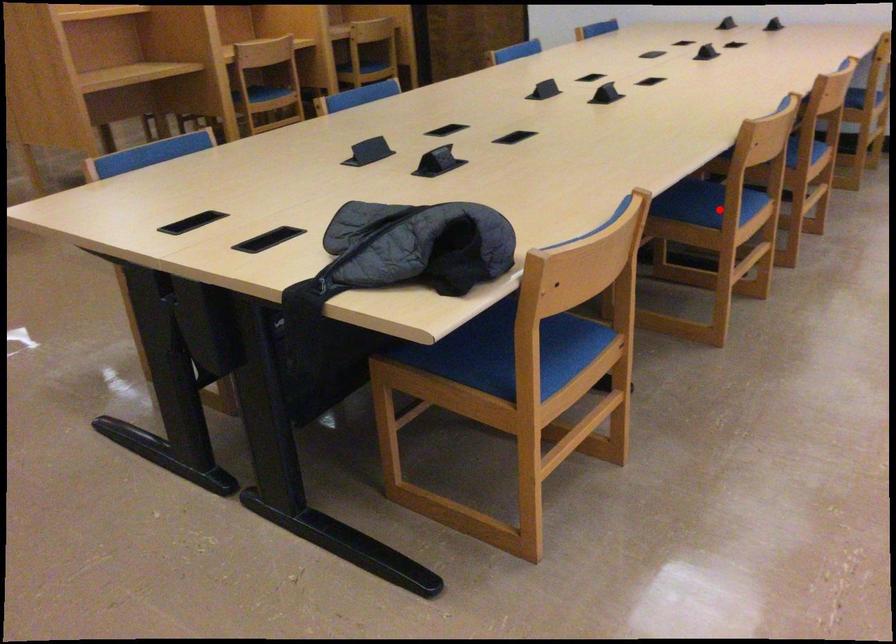
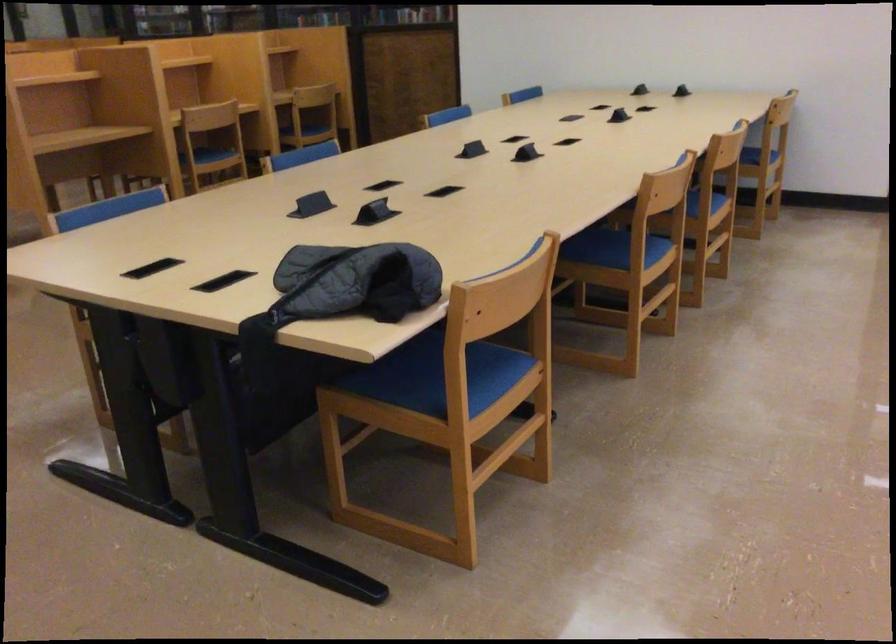
Question: I am providing you with two images of the same scene from different viewpoints. Given a red point in image1, look at the same physical point in image2. Is it:

Choices:
 (A) Closer to the viewpoint
 (B) Farther from the viewpoint

Answer: (B)